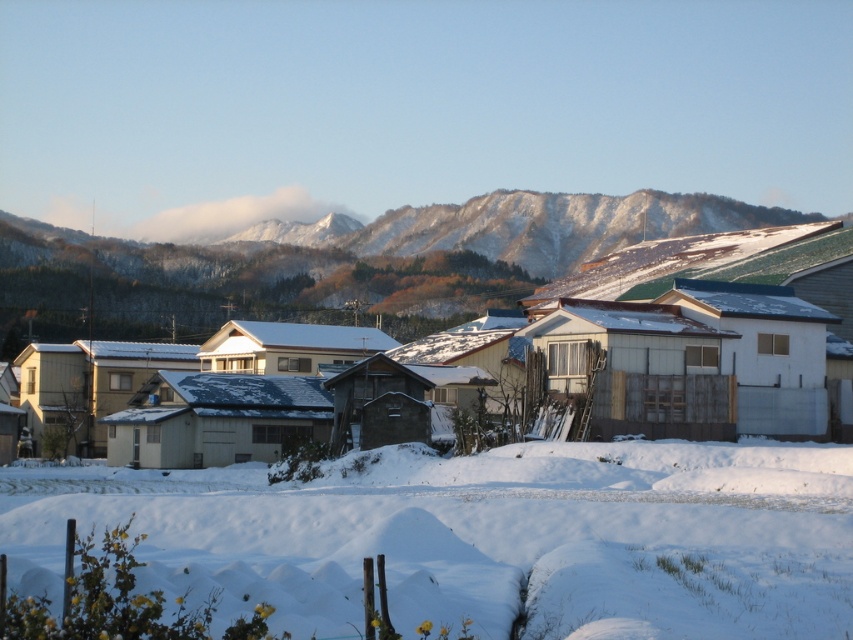
Question: Observing the image, what is the correct spatial positioning of white fluffy snow at center in reference to snowy mountain at upper center?

Choices:
 (A) left
 (B) right

Answer: (A)

Question: Is white fluffy snow at center above snowy mountain at upper center?

Choices:
 (A) no
 (B) yes

Answer: (A)

Question: Which point is farther from the camera taking this photo?

Choices:
 (A) (74, 260)
 (B) (798, 474)

Answer: (A)

Question: Which point is farther to the camera?

Choices:
 (A) white fluffy snow at center
 (B) snowy mountain at upper center

Answer: (B)

Question: Is white fluffy snow at center wider than snowy mountain at upper center?

Choices:
 (A) yes
 (B) no

Answer: (B)

Question: Which point is closer to the camera taking this photo?

Choices:
 (A) (752, 627)
 (B) (482, 298)

Answer: (A)